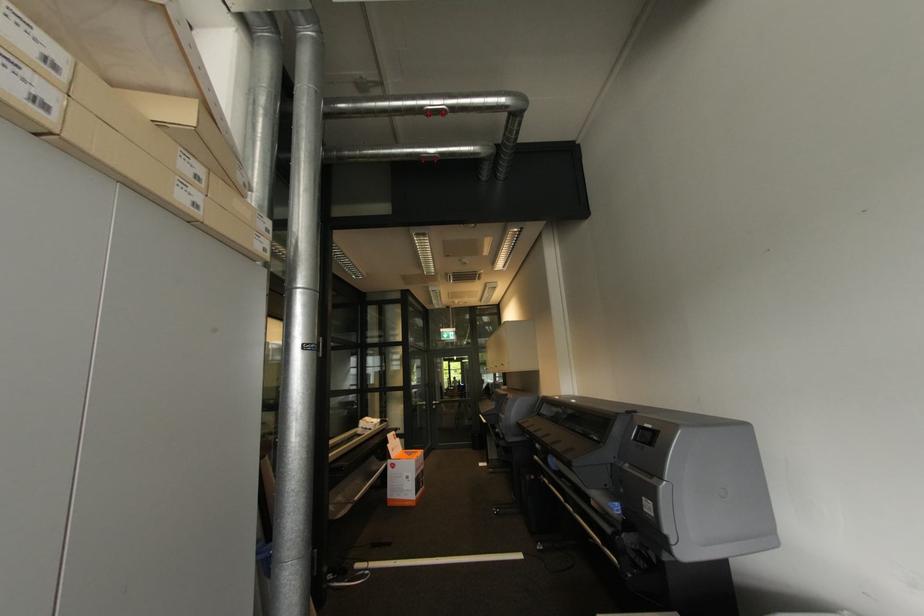
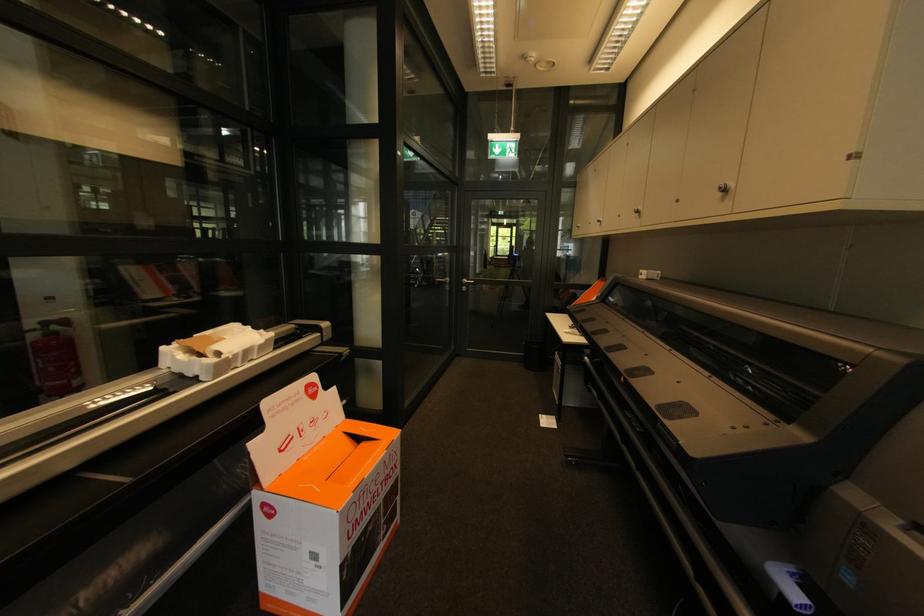
Find the pixel in the second image that matches point (505, 365) in the first image.

(727, 191)